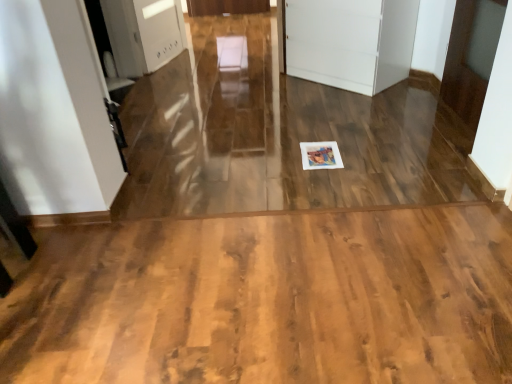
Image resolution: width=512 pixels, height=384 pixels. I want to click on vacant space to the left of white matte cabinet at center, which is the 2th door from right to left, so click(267, 86).